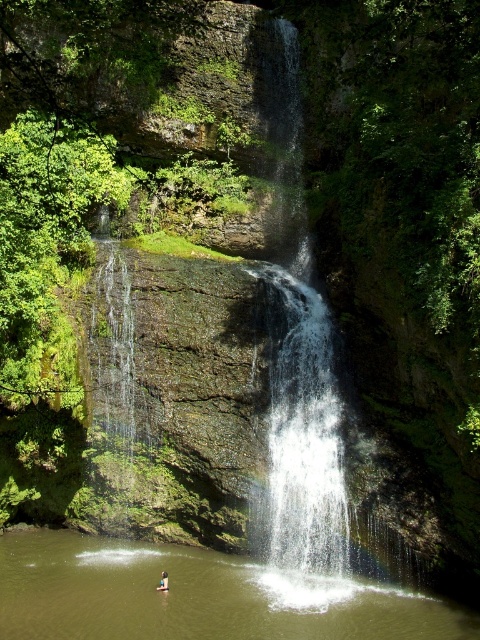
You are a hiker who wants to cross the waterfall area safely. You see the clear water at center and the light brown wooden stick at lower center. Which object is located higher up in the scene?

The clear water at center is positioned over the light brown wooden stick at lower center, so the clear water at center is higher up in the scene.

You are standing at the edge of the waterfall and see both the brown liquid water at center and the clear water at center. Which one is positioned to the left?

The brown liquid water at center is positioned to the left of the clear water at center.